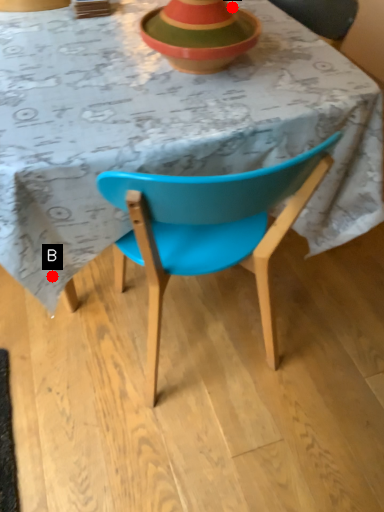
Question: Two points are circled on the image, labeled by A and B beside each circle. Among these points, which one is farthest from the camera?

Choices:
 (A) A is further
 (B) B is further

Answer: (A)